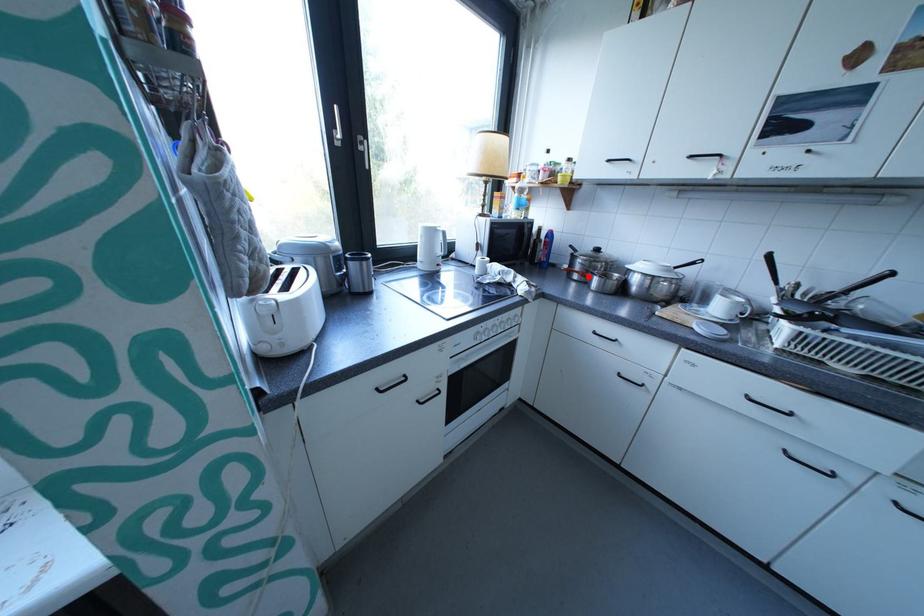
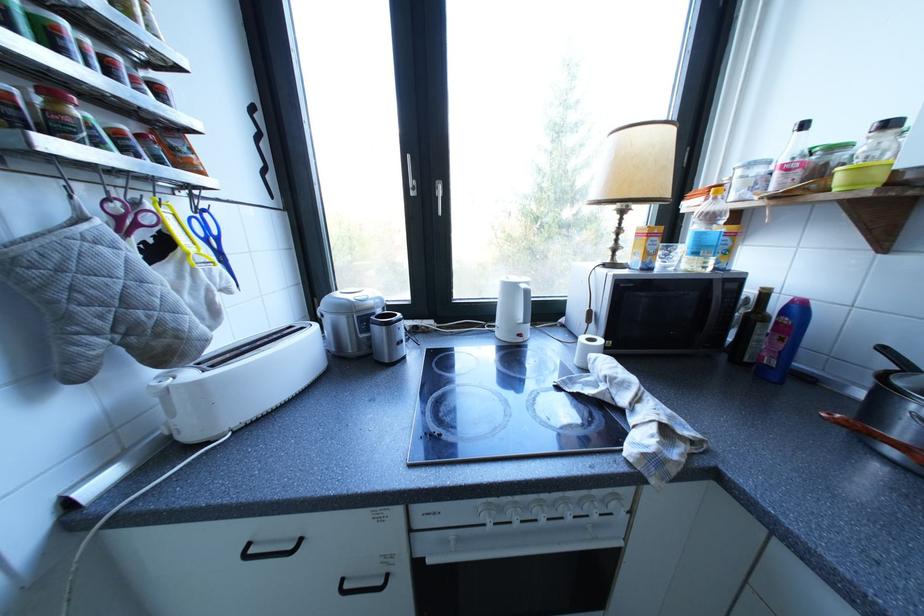
Locate, in the second image, the point that corresponds to the highlighted location in the first image.

(907, 454)